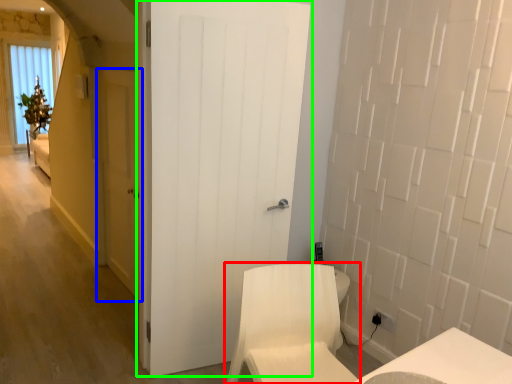
Question: Considering the real-world distances, which object is closest to furniture (highlighted by a red box)? door (highlighted by a blue box) or door (highlighted by a green box).

Choices:
 (A) door
 (B) door

Answer: (B)